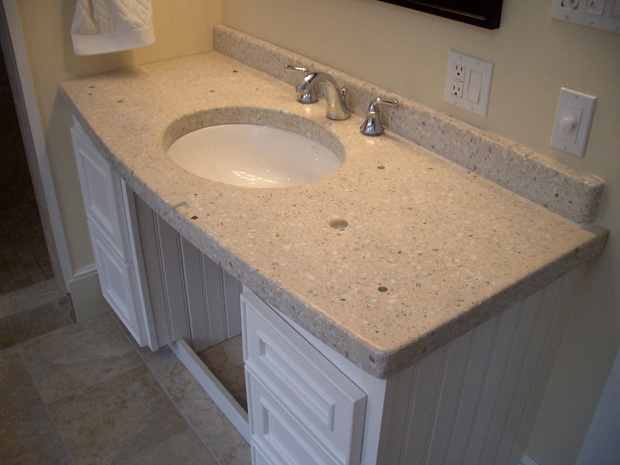
Find the location of a particular element. This screenshot has height=465, width=620. wall outlet is located at coordinates (461, 67), (454, 91).